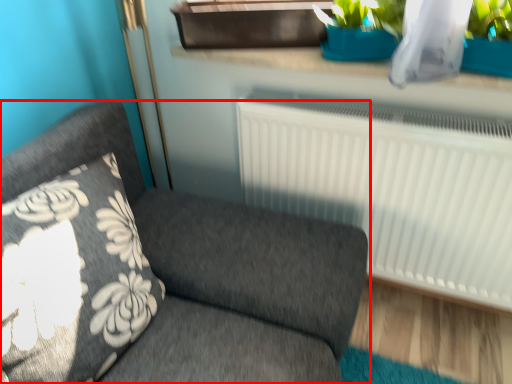
Question: From the image's perspective, where is furniture (annotated by the red box) located relative to window sill?

Choices:
 (A) above
 (B) below

Answer: (B)